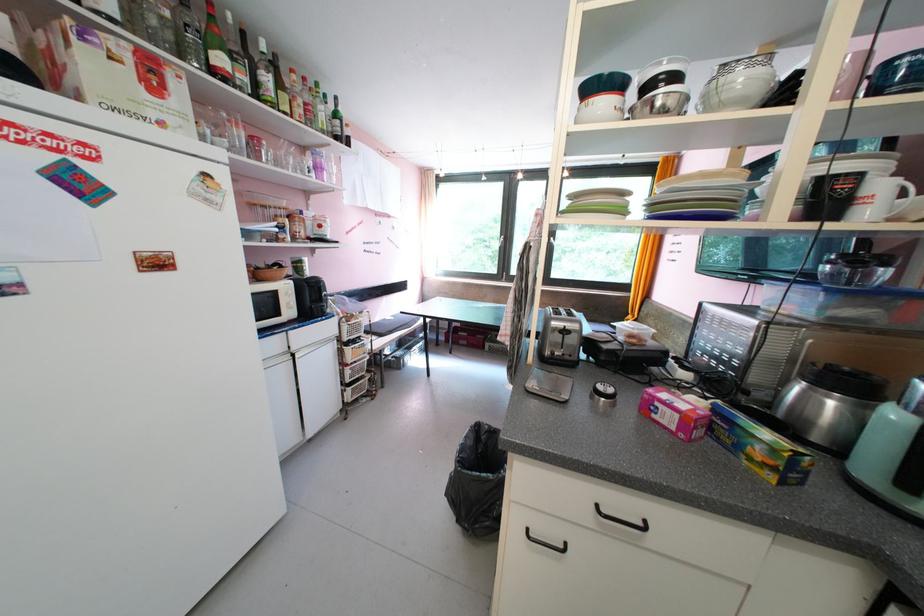
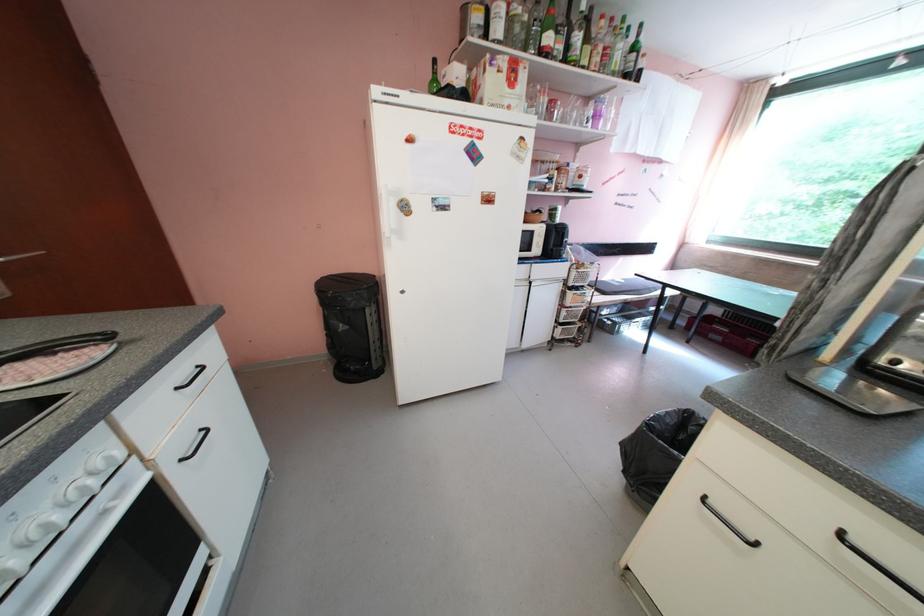
Locate, in the second image, the point that corresponds to the point at 351,346 in the first image.

(576, 290)